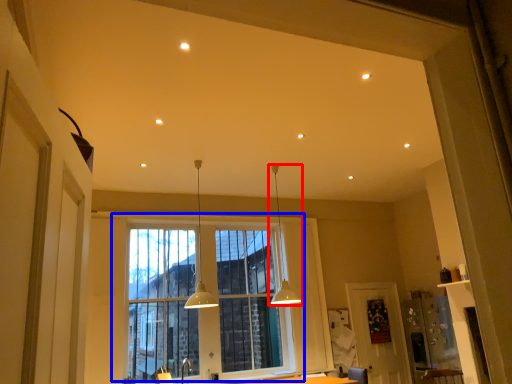
Question: Which point is further to the camera, lamp (highlighted by a red box) or window (highlighted by a blue box)?

Choices:
 (A) lamp
 (B) window

Answer: (B)